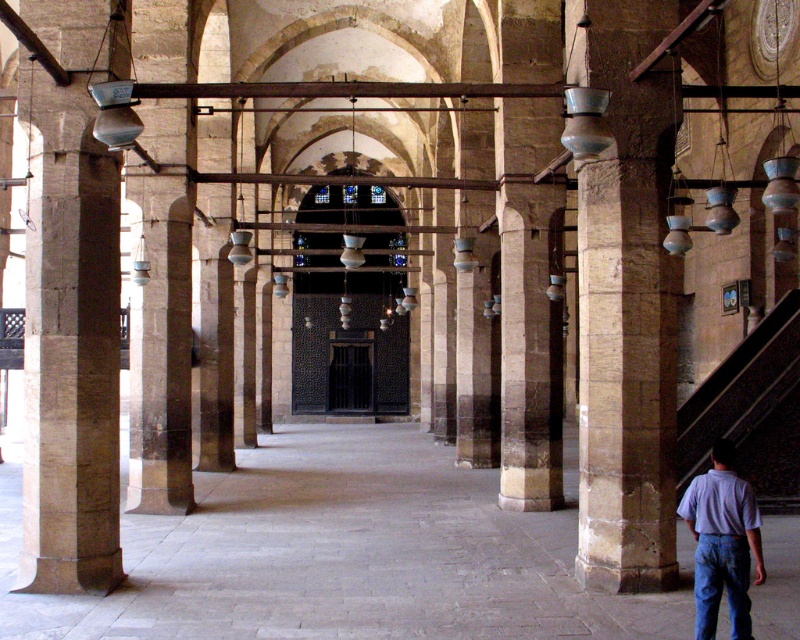
Does smooth stone column at left have a greater height compared to dark brown stone stairs at lower right?

In fact, smooth stone column at left may be shorter than dark brown stone stairs at lower right.

Does point (85, 404) come behind point (794, 464)?

No, (85, 404) is closer to viewer.

Identify the location of smooth stone column at left. tap(70, 308).

In the scene shown: Who is positioned more to the right, dark brown stone stairs at lower right or light blue shirt at lower right?

dark brown stone stairs at lower right is more to the right.

Can you confirm if dark brown stone stairs at lower right is shorter than light blue shirt at lower right?

Correct, dark brown stone stairs at lower right is not as tall as light blue shirt at lower right.

Who is more distant from viewer, (x=792, y=449) or (x=748, y=582)?

Positioned behind is point (x=792, y=449).

The height and width of the screenshot is (640, 800). Identify the location of dark brown stone stairs at lower right. (750, 406).

Which is behind, point (698, 598) or point (748, 570)?

The point (698, 598) is behind.

Is light blue shirt at lower right positioned behind blue denim jeans at lower right?

No, light blue shirt at lower right is closer to the viewer.

This screenshot has width=800, height=640. I want to click on light blue shirt at lower right, so click(722, 541).